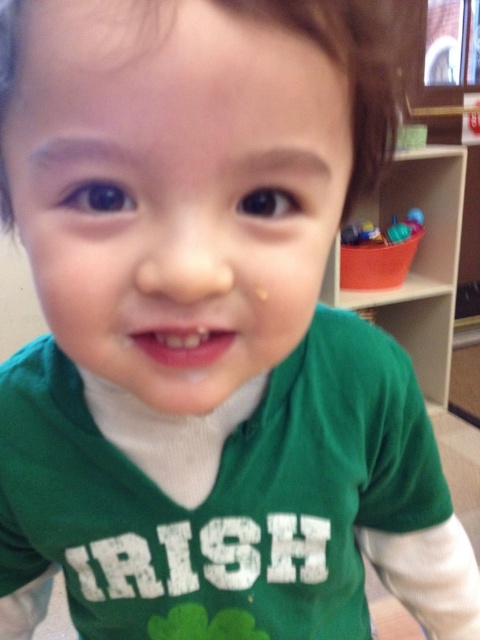
Can you confirm if white wood bookshelf at upper right is smaller than translucent plastic bucket at upper right?

Actually, white wood bookshelf at upper right might be larger than translucent plastic bucket at upper right.

Consider the image. Which is below, white wood bookshelf at upper right or translucent plastic bucket at upper right?

white wood bookshelf at upper right is below.

Does point (333, 298) come in front of point (404, 241)?

Yes, it is in front of point (404, 241).

Find the location of `white wood bookshelf at upper right`. white wood bookshelf at upper right is located at coordinates (416, 260).